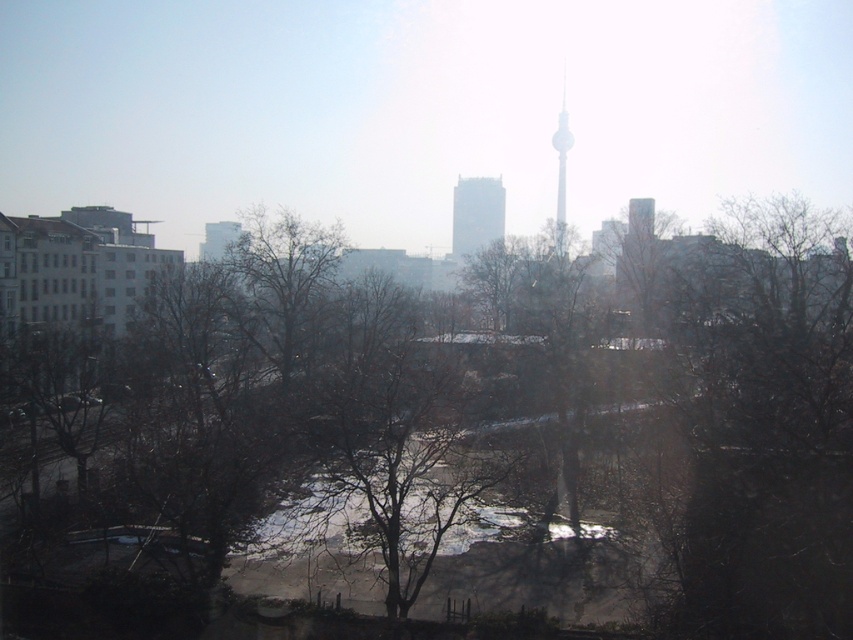
You are an architect analyzing the city skyline. You observe the smooth glass skyscraper at center and the white glass tower at center. Which structure has a smaller width when viewed from this perspective?

The smooth glass skyscraper at center is thinner than the white glass tower at center, so it has a smaller width when viewed from this perspective.

You are an urban planner assessing the city layout. You need to determine which object occupies more horizontal space in the image between the brown leafless tree at center and the white glass tower at center. Which one is wider?

The brown leafless tree at center is wider than the white glass tower at center according to the description provided.

You are a city planner analyzing the skyline. Which of the two buildings, the smooth glass skyscraper at center or the white glass tower at center, has a greater height?

The white glass tower at center is taller than the smooth glass skyscraper at center.